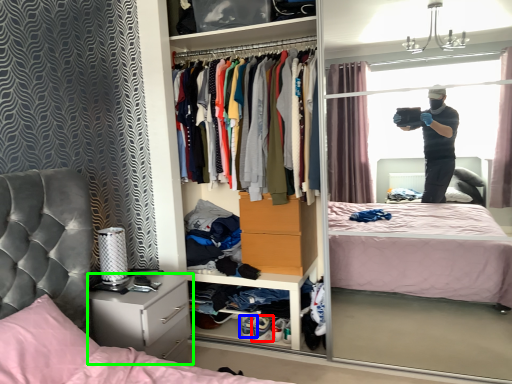
Question: Which object is the farthest from footwear (highlighted by a red box)? Choose among these: footwear (highlighted by a blue box) or cabinetry (highlighted by a green box).

Choices:
 (A) footwear
 (B) cabinetry

Answer: (B)